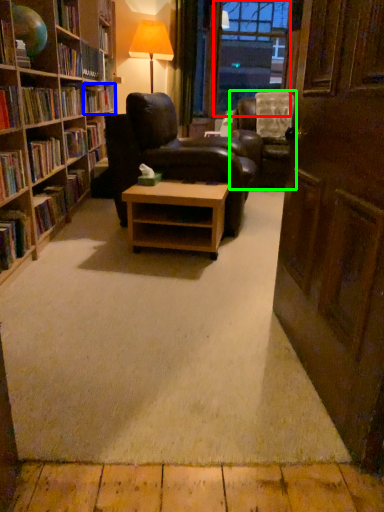
Question: Which is nearer to the window screen (highlighted by a red box)? book (highlighted by a blue box) or chair (highlighted by a green box).

Choices:
 (A) book
 (B) chair

Answer: (B)